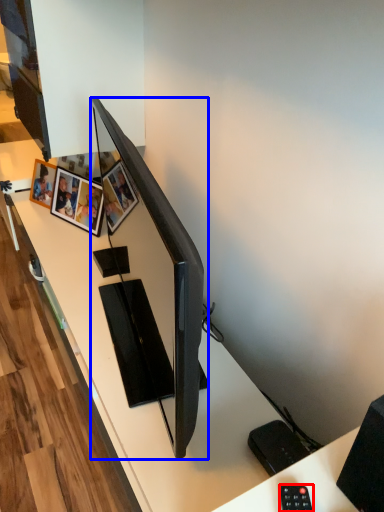
Question: Which point is closer to the camera, control (highlighted by a red box) or television (highlighted by a blue box)?

Choices:
 (A) control
 (B) television

Answer: (A)